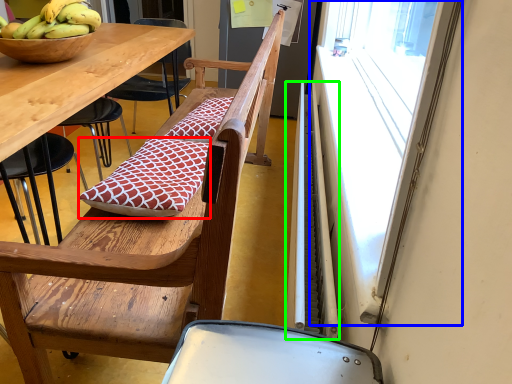
Question: Which object is the farthest from pillow (highlighted by a red box)? Choose among these: window screen (highlighted by a blue box) or radiator (highlighted by a green box).

Choices:
 (A) window screen
 (B) radiator

Answer: (A)